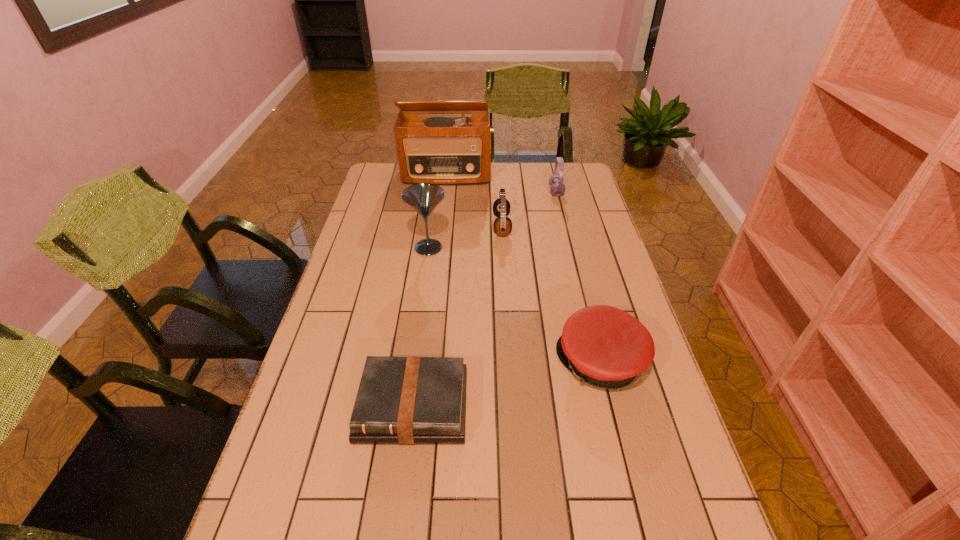
Image resolution: width=960 pixels, height=540 pixels. Find the location of `free space located on the headband and ear cups of the right headset`. free space located on the headband and ear cups of the right headset is located at coordinates (502, 192).

The image size is (960, 540). I want to click on free spot located on the ear cups of the nearer headset, so click(x=438, y=226).

Where is `vacant region located on the ear cups of the nearer headset`? This screenshot has width=960, height=540. vacant region located on the ear cups of the nearer headset is located at coordinates (479, 226).

This screenshot has height=540, width=960. Identify the location of free space located on the ear cups of the nearer headset. (421, 226).

This screenshot has height=540, width=960. I want to click on vacant position located 0.200m on the front-facing side of the second shortest object, so click(481, 363).

Locate an element on the screen. The image size is (960, 540). vacant region located on the front-facing side of the second shortest object is located at coordinates (423, 363).

Where is `vacant space situated 0.320m on the front-facing side of the second shortest object`? The width and height of the screenshot is (960, 540). vacant space situated 0.320m on the front-facing side of the second shortest object is located at coordinates point(435,363).

Where is `vacant space located on the spine side of the shortest object`? The image size is (960, 540). vacant space located on the spine side of the shortest object is located at coordinates (403, 483).

Find the location of `radio receiver positioned at the far edge`. radio receiver positioned at the far edge is located at coordinates (443, 150).

At what (x,y) coordinates should I click in order to perform the action: click on headset present at the far edge. Please return your answer as a coordinate pair (x, y). Image resolution: width=960 pixels, height=540 pixels. Looking at the image, I should click on (x=557, y=188).